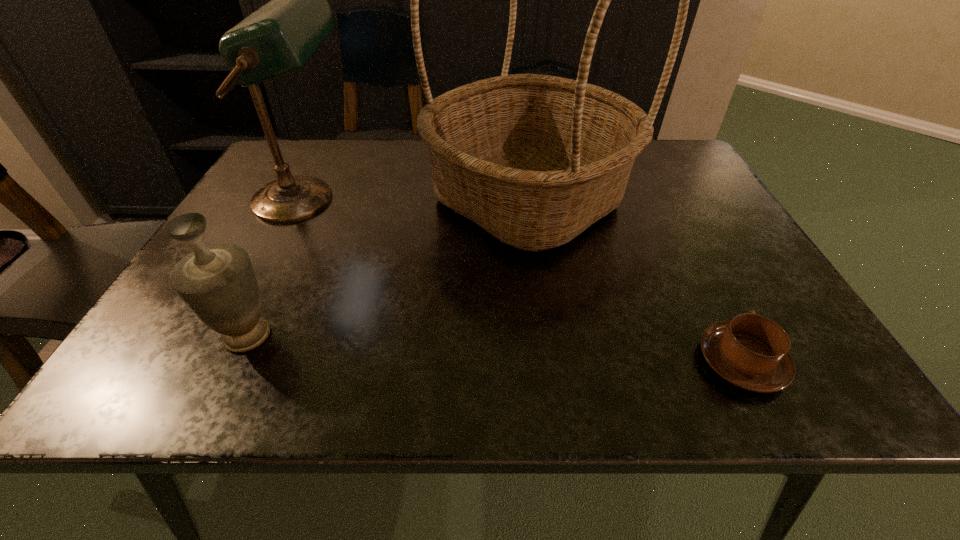
I want to click on basket, so (x=534, y=160).

Where is `the second object from right to left`? This screenshot has width=960, height=540. the second object from right to left is located at coordinates (534, 160).

Where is `the second tallest object`? the second tallest object is located at coordinates (278, 38).

Locate an element on the screen. The image size is (960, 540). the third tallest object is located at coordinates (217, 283).

The width and height of the screenshot is (960, 540). I want to click on cappuccino, so click(x=751, y=352).

At what (x,y) coordinates should I click in order to perform the action: click on the rightmost object. Please return your answer as a coordinate pair (x, y). Looking at the image, I should click on coord(751,352).

Where is `vacant point located on the left of the tallest object`? The height and width of the screenshot is (540, 960). vacant point located on the left of the tallest object is located at coordinates (307, 198).

The image size is (960, 540). What are the coordinates of `blank space located above the green lampshade of the second tallest object` in the screenshot? It's located at (491, 200).

This screenshot has width=960, height=540. What are the coordinates of `free space located on the back of the third tallest object` in the screenshot? It's located at (308, 209).

The image size is (960, 540). Find the location of `free location located 0.090m on the side of the shortest object with the handle`. free location located 0.090m on the side of the shortest object with the handle is located at coordinates (707, 293).